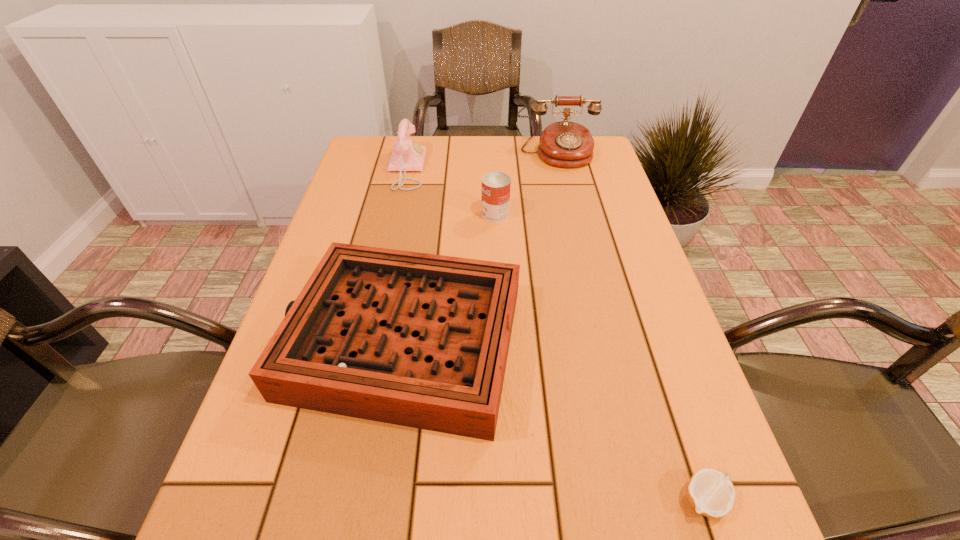
The height and width of the screenshot is (540, 960). What are the coordinates of `object positioned at the far right corner` in the screenshot? It's located at (566, 144).

This screenshot has width=960, height=540. In the image, there is a desktop. Find the location of `free space at the far edge`. free space at the far edge is located at coordinates (450, 168).

The image size is (960, 540). What are the coordinates of `free point at the left edge` in the screenshot? It's located at (351, 211).

This screenshot has width=960, height=540. Find the location of `vacant space at the right edge of the desktop`. vacant space at the right edge of the desktop is located at coordinates click(x=684, y=500).

The height and width of the screenshot is (540, 960). Find the location of `vacant space at the far left corner of the desktop`. vacant space at the far left corner of the desktop is located at coordinates (387, 172).

Locate an element on the screen. empty space between the nearest object and the can is located at coordinates (600, 357).

Locate an element on the screen. The height and width of the screenshot is (540, 960). vacant region between the right telephone and the can is located at coordinates (526, 185).

At what (x,y) coordinates should I click in order to perform the action: click on empty space between the nearest object and the right telephone. Please return your answer as a coordinate pair (x, y). This screenshot has width=960, height=540. Looking at the image, I should click on (631, 327).

I want to click on free spot between the nearest object and the taller telephone, so click(631, 327).

This screenshot has width=960, height=540. What are the coordinates of `vacant space in between the right telephone and the shortest object` in the screenshot? It's located at (631, 327).